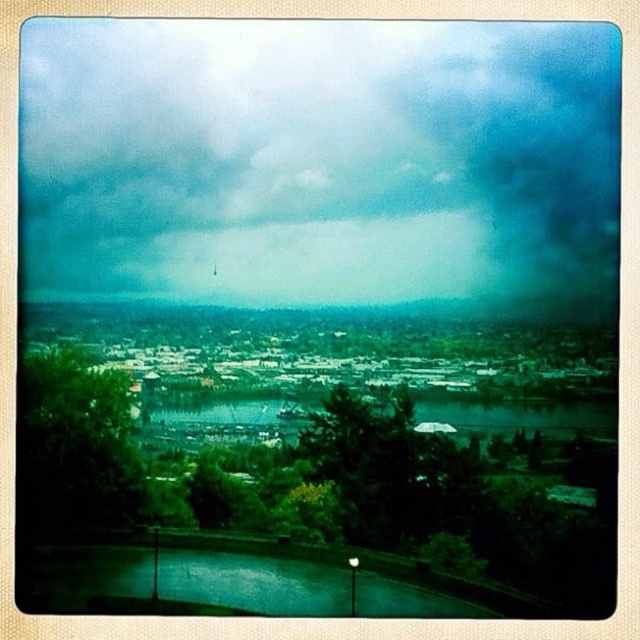
Question: Which point is closer to the camera?

Choices:
 (A) (385, 596)
 (B) (515, 408)

Answer: (B)

Question: Which of the following is the farthest from the observer?

Choices:
 (A) greenish-blue water at center
 (B) cloudy sky at upper center
 (C) green glass lake at lower center

Answer: (C)

Question: Is cloudy sky at upper center to the right of greenish-blue water at center from the viewer's perspective?

Choices:
 (A) yes
 (B) no

Answer: (B)

Question: Is the position of green glass lake at lower center more distant than that of greenish-blue water at center?

Choices:
 (A) yes
 (B) no

Answer: (A)

Question: Where is cloudy sky at upper center located in relation to green glass lake at lower center in the image?

Choices:
 (A) right
 (B) left

Answer: (A)

Question: Which point is closer to the camera taking this photo?

Choices:
 (A) (481, 198)
 (B) (182, 589)
 (C) (522, 428)

Answer: (A)